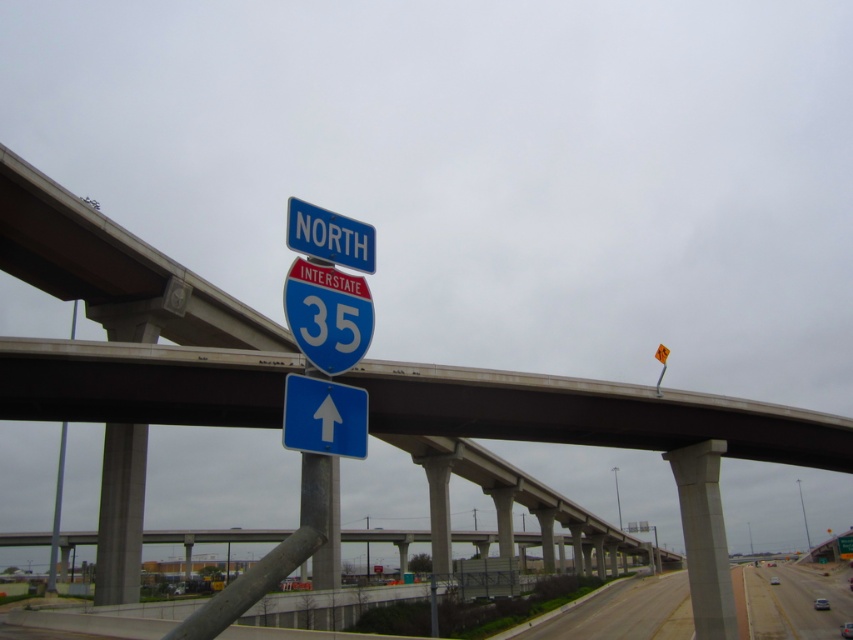
Question: Can you confirm if blue glossy arrow at center is thinner than blue plastic sign at upper center?

Choices:
 (A) no
 (B) yes

Answer: (B)

Question: Which of the following is the closest to the observer?

Choices:
 (A) metallic gray pole at left
 (B) blue plastic sign at upper center
 (C) blue glossy arrow at center
 (D) gray concrete highway at lower right

Answer: (C)

Question: Which object is the farthest from the blue plastic sign at upper center?

Choices:
 (A) metallic gray pole at left
 (B) blue glossy arrow at center
 (C) gray concrete highway at lower right

Answer: (C)

Question: Can you confirm if gray concrete highway at lower right is smaller than blue glossy arrow at center?

Choices:
 (A) yes
 (B) no

Answer: (B)

Question: Which point is closer to the camera?

Choices:
 (A) (753, 595)
 (B) (57, 545)
 (C) (352, 234)
 (D) (294, 404)

Answer: (D)

Question: Is gray concrete highway at lower right in front of blue glossy arrow at center?

Choices:
 (A) yes
 (B) no

Answer: (B)